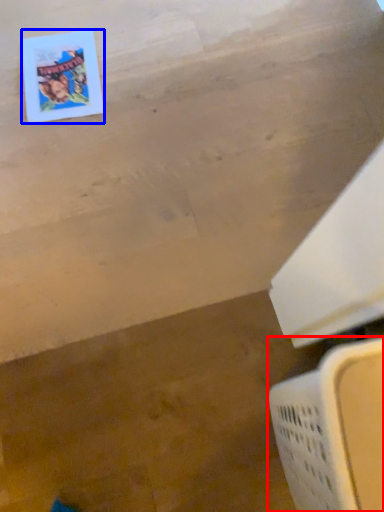
Question: Which of the following is the farthest to the observer, laundry basket (highlighted by a red box) or comic book (highlighted by a blue box)?

Choices:
 (A) laundry basket
 (B) comic book

Answer: (B)